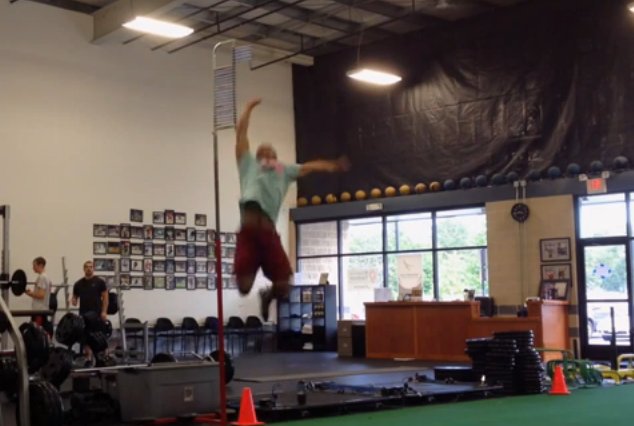
Where is `door, glass, black borders`? The image size is (634, 426). door, glass, black borders is located at coordinates (617, 279).